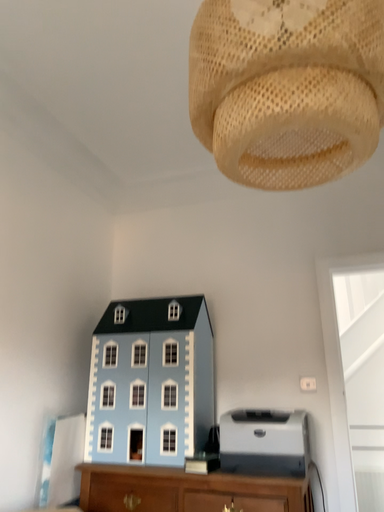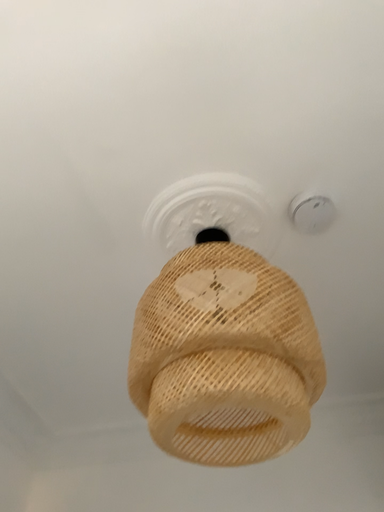
Question: How did the camera likely rotate when shooting the video?

Choices:
 (A) rotated downward
 (B) rotated upward

Answer: (B)